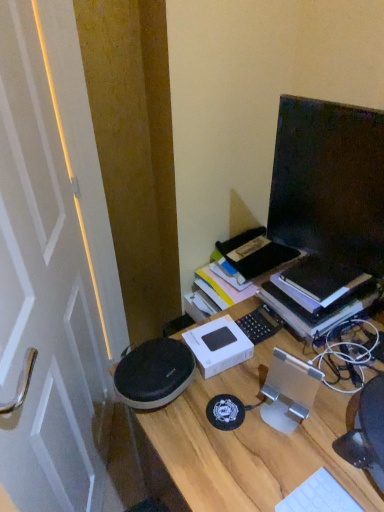
Locate an element on the screen. The image size is (384, 512). wooden desk at center is located at coordinates [x=251, y=443].

You are a GUI agent. You are given a task and a screenshot of the screen. Output one action in this format:
    pyautogui.click(x=<x>, y=<y>)
    Task: Click on the hardcover book at right
    
    Given the screenshot: What is the action you would take?
    pyautogui.click(x=318, y=294)

What is the approximate height of white glossy door at left?

white glossy door at left is 1.09 meters in height.

The width and height of the screenshot is (384, 512). I want to click on black glossy monitor at upper right, so click(x=329, y=181).

Locate an element on the screen. The width and height of the screenshot is (384, 512). desk below the hardcover book at right (from the image's perspective) is located at coordinates (251, 443).

From a real-world perspective, which object rests below the other?

In real-world perspective, wooden desk at center is lower.

From the image's perspective, is wooden desk at center located beneath hardcover book at right?

Correct, wooden desk at center appears lower than hardcover book at right in the image.

Would you say wooden desk at center is inside or outside hardcover book at right?

wooden desk at center exists outside the volume of hardcover book at right.

Considering the positions of objects hardcover book at right and wooden desk at center in the image provided, who is behind, hardcover book at right or wooden desk at center?

hardcover book at right is behind.

In order to click on book above the wooden desk at center (from the image's perspective) in this screenshot , I will do `click(318, 294)`.

Is hardcover book at right far from wooden desk at center?

hardcover book at right is near wooden desk at center, not far away.

What's the angular difference between hardcover book at right and wooden desk at center's facing directions?

hardcover book at right and wooden desk at center are facing 1.63 degrees away from each other.

Can we say wooden desk at center lies outside white plastic keyboard at lower right?

Absolutely, wooden desk at center is external to white plastic keyboard at lower right.

Which is more to the left, wooden desk at center or white plastic keyboard at lower right?

Positioned to the left is white plastic keyboard at lower right.

How many degrees apart are the facing directions of wooden desk at center and white plastic keyboard at lower right?

There is a 0.606-degree angle between the facing directions of wooden desk at center and white plastic keyboard at lower right.

Is wooden desk at center aimed at white glossy door at left?

No, wooden desk at center is not oriented towards white glossy door at left.

What's the angular difference between wooden desk at center and white glossy door at left's facing directions?

There is a 30.5-degree angle between the facing directions of wooden desk at center and white glossy door at left.

From the image's perspective, is wooden desk at center located beneath white glossy door at left?

Indeed, from the image's perspective, wooden desk at center is shown beneath white glossy door at left.

Considering the relative sizes of wooden desk at center and white glossy door at left in the image provided, is wooden desk at center wider than white glossy door at left?

Yes.

Measure the distance between black glossy monitor at upper right and wooden desk at center.

black glossy monitor at upper right and wooden desk at center are 39.86 centimeters apart.

Is black glossy monitor at upper right to the right of wooden desk at center from the viewer's perspective?

Incorrect, black glossy monitor at upper right is not on the right side of wooden desk at center.

Could you tell me if black glossy monitor at upper right is turned towards wooden desk at center?

No, black glossy monitor at upper right does not turn towards wooden desk at center.

Is point (289, 112) behind point (177, 438)?

Yes, point (289, 112) is farther from viewer.

Looking at their sizes, would you say hardcover book at right is wider or thinner than white plastic keyboard at lower right?

Clearly, hardcover book at right has more width compared to white plastic keyboard at lower right.

Is hardcover book at right closer to the viewer compared to white plastic keyboard at lower right?

No, it is behind white plastic keyboard at lower right.

Are hardcover book at right and white plastic keyboard at lower right located far from each other?

No.

Is hardcover book at right not within white plastic keyboard at lower right?

Yes.

In the scene shown: From a real-world perspective, is black glossy monitor at upper right on top of white plastic keyboard at lower right?

Yes, from a real-world perspective, black glossy monitor at upper right is over white plastic keyboard at lower right

Which of these two, black glossy monitor at upper right or white plastic keyboard at lower right, stands shorter?

Standing shorter between the two is white plastic keyboard at lower right.

Which object is closer to the camera, black glossy monitor at upper right or white plastic keyboard at lower right?

white plastic keyboard at lower right is closer to the camera.

From the image's perspective, who appears lower, black glossy monitor at upper right or white plastic keyboard at lower right?

white plastic keyboard at lower right appears lower in the image.

In the image, there is a wooden desk at center. In order to click on book above it (from the image's perspective) in this screenshot , I will do `click(318, 294)`.

You are a GUI agent. You are given a task and a screenshot of the screen. Output one action in this format:
    pyautogui.click(x=<x>, y=<y>)
    Task: Click on the desk in front of the hardcover book at right
    This screenshot has height=512, width=384.
    Given the screenshot: What is the action you would take?
    pyautogui.click(x=251, y=443)

Looking at the image, which one is located further to hardcover book at right, white glossy door at left or wooden desk at center?

white glossy door at left is positioned further to the anchor hardcover book at right.

When comparing their distances from hardcover book at right, does white plastic keyboard at lower right or white glossy door at left seem closer?

white plastic keyboard at lower right is positioned closer to the anchor hardcover book at right.

Estimate the real-world distances between objects in this image. Which object is closer to hardcover book at right, black glossy monitor at upper right or wooden desk at center?

black glossy monitor at upper right lies closer to hardcover book at right than the other object.

Looking at this image, from the image, which object appears to be farther from white glossy door at left, black glossy monitor at upper right or hardcover book at right?

hardcover book at right is positioned further to the anchor white glossy door at left.

Based on the photo, looking at the image, which one is located closer to wooden desk at center, white glossy door at left or black glossy monitor at upper right?

black glossy monitor at upper right lies closer to wooden desk at center than the other object.

Looking at the image, which one is located further to black glossy monitor at upper right, white glossy door at left or white plastic keyboard at lower right?

white glossy door at left lies further to black glossy monitor at upper right than the other object.

In the scene shown: When comparing their distances from wooden desk at center, does hardcover book at right or white glossy door at left seem closer?

Based on the image, hardcover book at right appears to be nearer to wooden desk at center.

Based on their spatial positions, is hardcover book at right or wooden desk at center further from black glossy monitor at upper right?

wooden desk at center.

Identify the location of computer monitor between white glossy door at left and hardcover book at right in the horizontal direction. The image size is (384, 512). (329, 181).

The height and width of the screenshot is (512, 384). What are the coordinates of `computer keyboard between black glossy monitor at upper right and wooden desk at center in the vertical direction` in the screenshot? It's located at (319, 496).

You are a GUI agent. You are given a task and a screenshot of the screen. Output one action in this format:
    pyautogui.click(x=<x>, y=<y>)
    Task: Click on the book between black glossy monitor at upper right and white plastic keyboard at lower right in the up-down direction
    
    Given the screenshot: What is the action you would take?
    pyautogui.click(x=318, y=294)

Identify the location of computer keyboard between white glossy door at left and hardcover book at right in the horizontal direction. (319, 496).